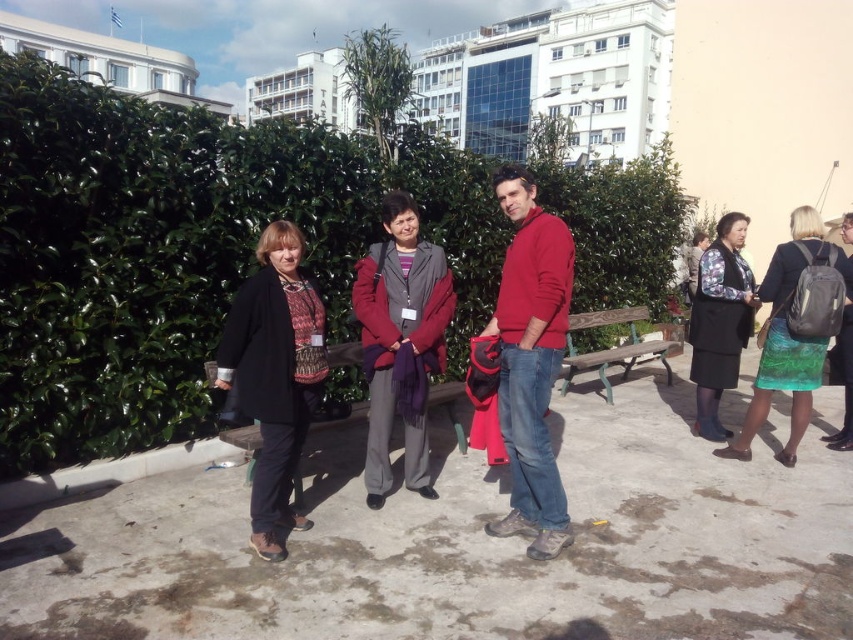
You are a photographer trying to capture the green textured skirt at right and the wooden park bench at center in the same frame. Based on their positions, will the skirt appear higher or lower in the photo compared to the bench?

The green textured skirt at right is located above the wooden park bench at center, so in the photo, the skirt will appear higher than the bench.

You are a photographer trying to capture a candid shot of the green textured skirt at right and the wooden bench at center. Since the skirt is partially covering the bench, which object should you focus on to ensure both are clearly visible in the photo?

The green textured skirt at right is positioned over wooden bench at center, so focusing on the skirt will ensure both the skirt and the bench are visible in the photo.

You are a photographer setting up for a group photo. You need to position the green textured skirt at right and the wooden bench at center so they are exactly 6 feet apart. Based on the current scene, will you need to move them closer or farther apart to achieve this distance?

The green textured skirt at right and wooden bench at center are currently 6.77 feet apart. To reach the desired 6 feet, you need to move them closer by 0.77 feet.